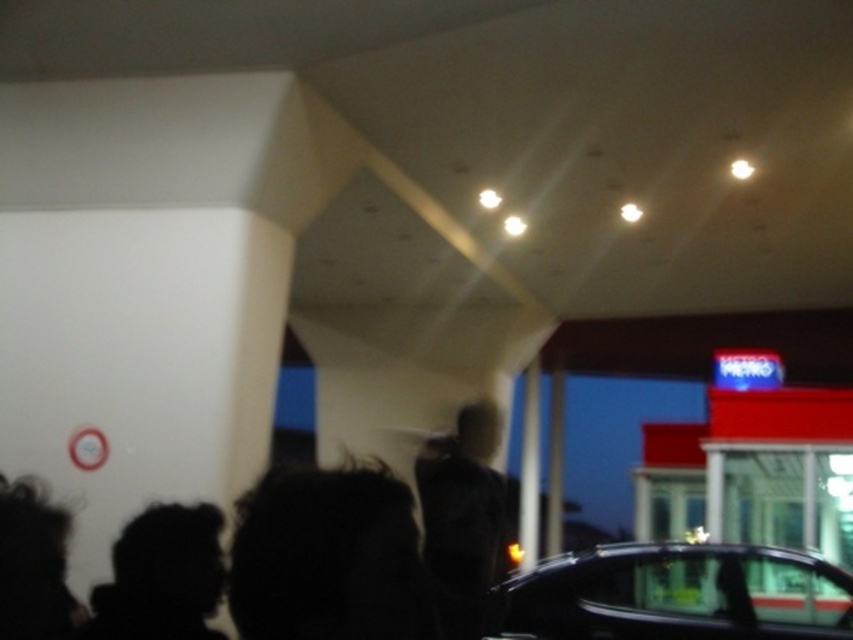
Can you confirm if shiny black car at lower right is thinner than dark matte jacket at center?

No, shiny black car at lower right is not thinner than dark matte jacket at center.

Can you confirm if shiny black car at lower right is wider than dark matte jacket at center?

Yes.

Between point (660, 582) and point (485, 451), which one is positioned behind?

Positioned behind is point (485, 451).

Where is `shiny black car at lower right`? shiny black car at lower right is located at coordinates (677, 593).

Does dark matte jacket at center lie in front of black silhouette at lower left?

Yes, dark matte jacket at center is in front of black silhouette at lower left.

Does point (445, 625) lie behind point (148, 515)?

That is False.

In order to click on dark matte jacket at center in this screenshot , I will do `click(462, 518)`.

Can you confirm if shiny black car at lower right is positioned to the left of black silhouette at lower left?

In fact, shiny black car at lower right is to the right of black silhouette at lower left.

Who is more forward, (x=577, y=576) or (x=155, y=513)?

Point (x=155, y=513)

Where is `shiny black car at lower right`? The width and height of the screenshot is (853, 640). shiny black car at lower right is located at coordinates (677, 593).